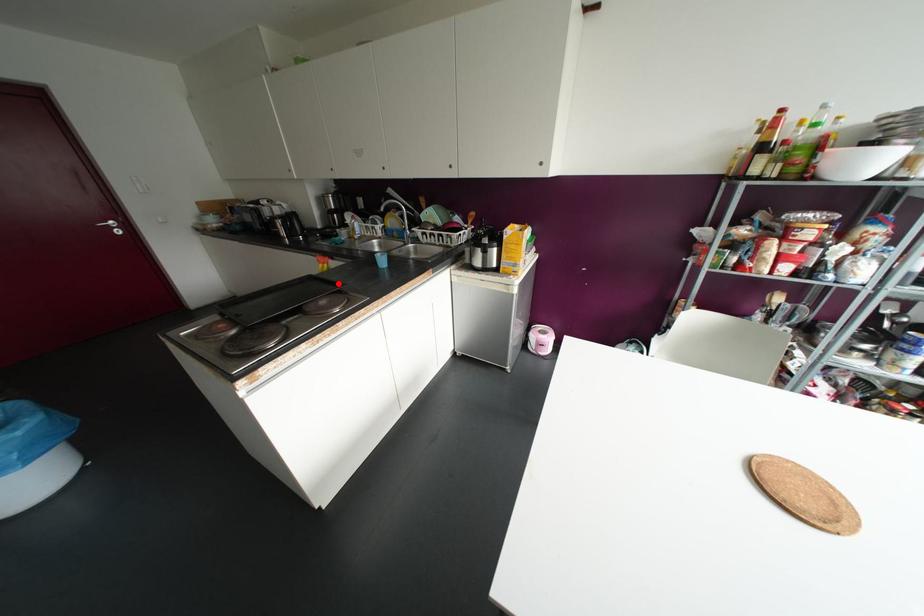
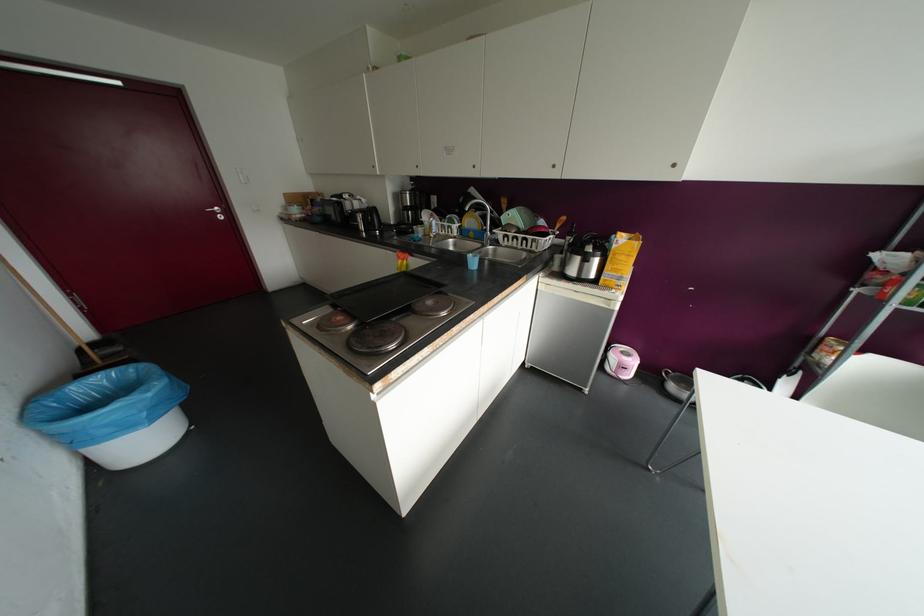
Locate, in the second image, the point that corresponds to the highlighted location in the first image.

(441, 284)